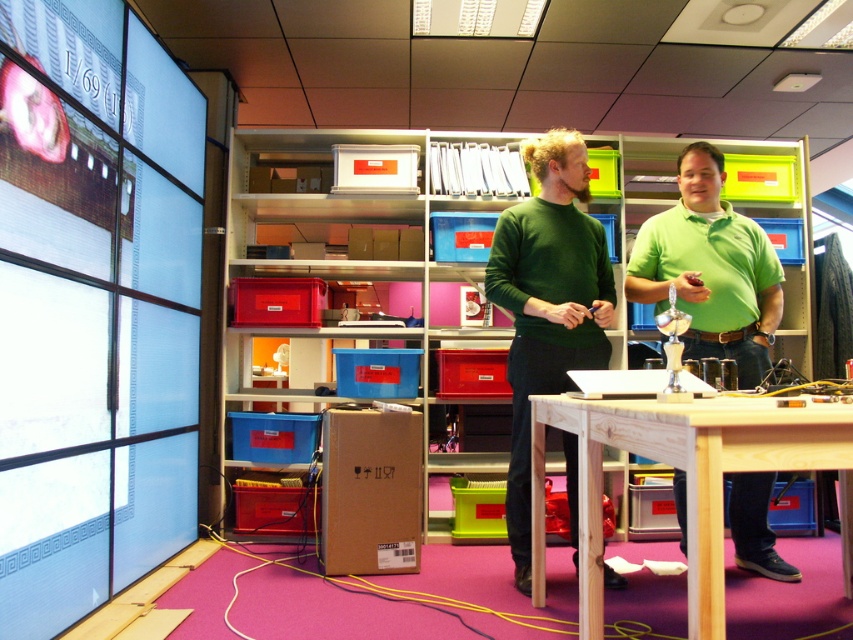
Question: From the image, what is the correct spatial relationship of light brown wood table at center in relation to green matte shirt at center?

Choices:
 (A) below
 (B) above

Answer: (A)

Question: Which of the following is the farthest from the observer?

Choices:
 (A) green matte shirt at center
 (B) light brown wood table at center

Answer: (A)

Question: Which of the following is the closest to the observer?

Choices:
 (A) (514, 340)
 (B) (664, 241)
 (C) (584, 576)

Answer: (C)

Question: Which point is closer to the camera?

Choices:
 (A) green matte shirt at center
 (B) green sweater at center
 (C) light brown wood table at center

Answer: (C)

Question: Can you confirm if light brown wood table at center is smaller than green matte shirt at center?

Choices:
 (A) yes
 (B) no

Answer: (B)

Question: Does light brown wood table at center have a larger size compared to green matte shirt at center?

Choices:
 (A) no
 (B) yes

Answer: (B)